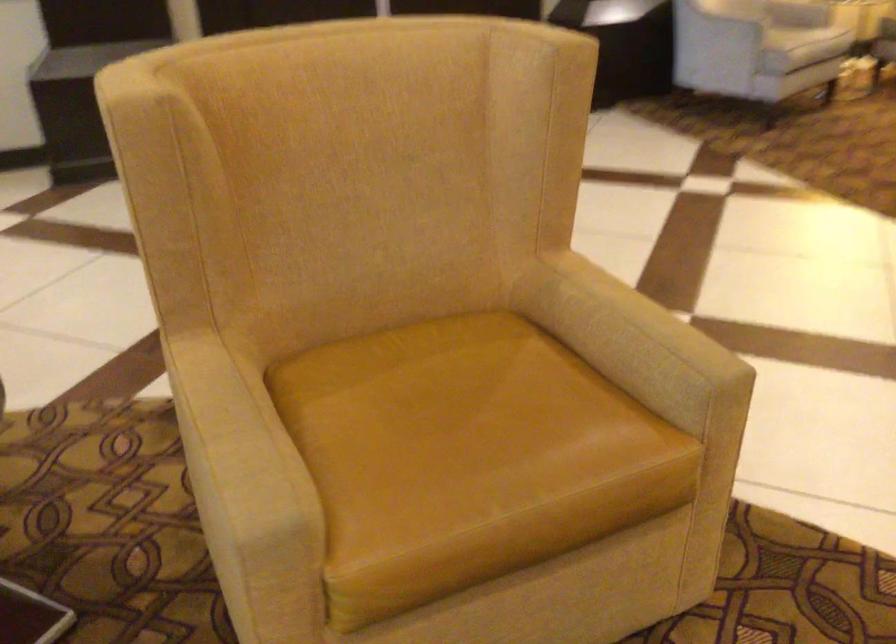
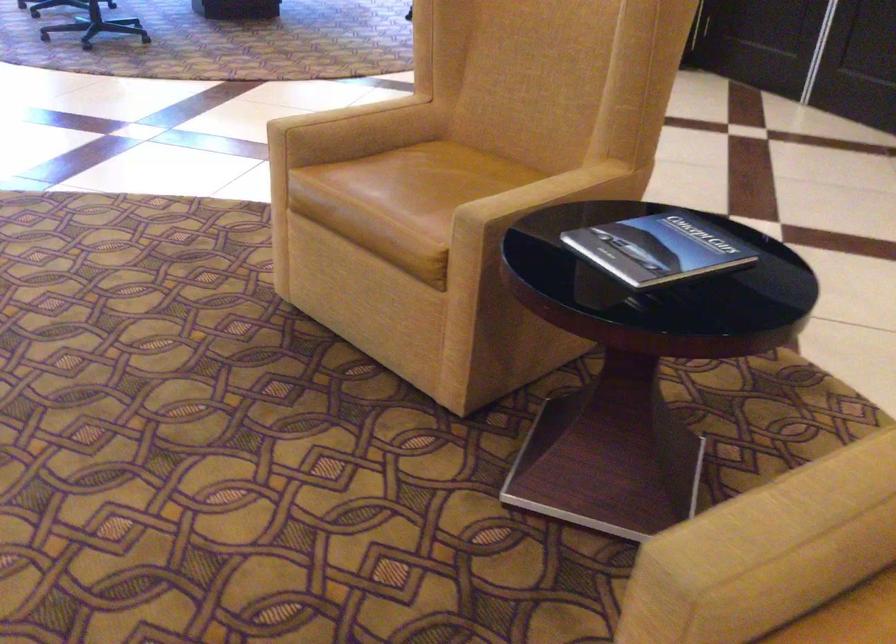
In the second image, find the point that corresponds to the point at 280,460 in the first image.

(778, 543)